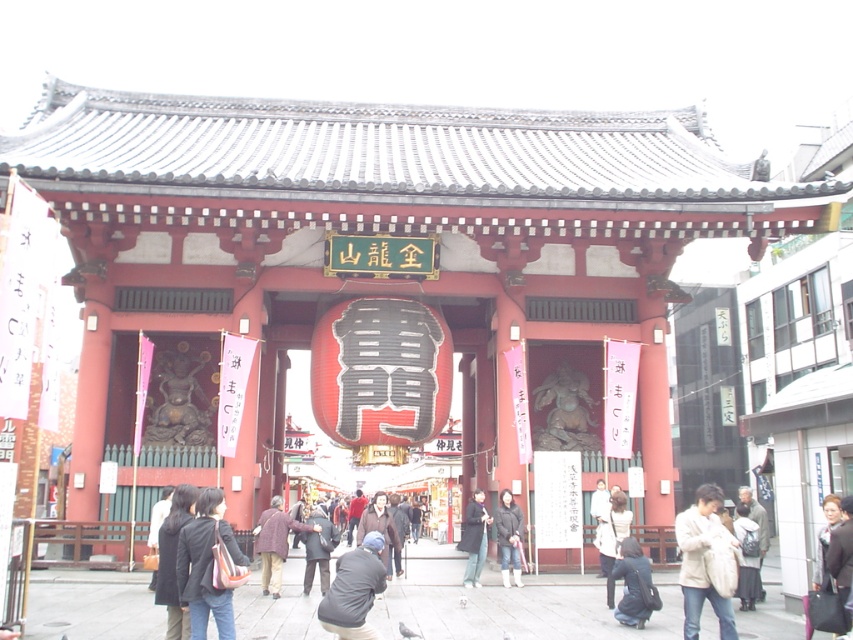
You are standing in front of the traditional Japanese gate and see a dark blue leather jacket at lower center and a brown wool coat at center. Which one is more to the right?

The dark blue leather jacket at lower center is more to the right side of the brown wool coat at center.

You are standing in front of the traditional Japanese gate and notice two jackets. The dark brown leather jacket at lower left and the dark gray jacket at lower center. Which jacket is positioned higher?

The dark brown leather jacket at lower left is positioned higher than the dark gray jacket at lower center.

What is located at the coordinates point [206,566]?

The dark brown leather jacket at lower left is located at point [206,566].